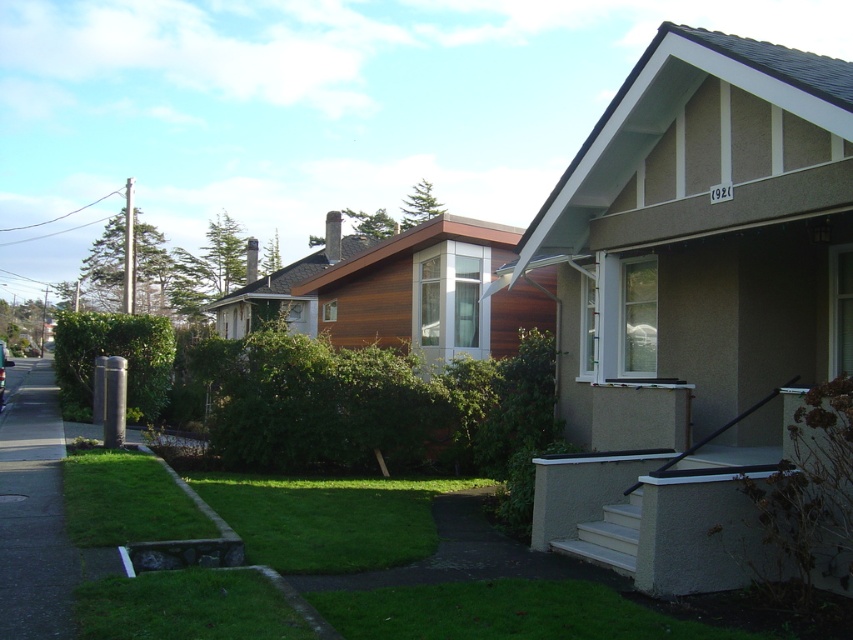
Question: Is gray concrete sidewalk at lower left above green grass at lower center?

Choices:
 (A) yes
 (B) no

Answer: (B)

Question: From the image, what is the correct spatial relationship of gray concrete sidewalk at lower left in relation to green grass at lower center?

Choices:
 (A) left
 (B) right

Answer: (A)

Question: Among these points, which one is nearest to the camera?

Choices:
 (A) (257, 605)
 (B) (27, 563)

Answer: (A)

Question: Does gray concrete sidewalk at lower left appear on the right side of green grass at lower center?

Choices:
 (A) yes
 (B) no

Answer: (B)